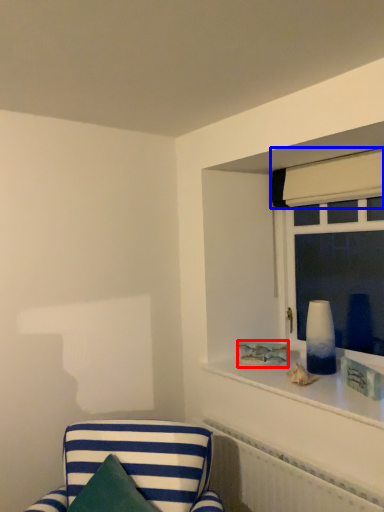
Question: Which object appears farthest to the camera in this image, picture frame (highlighted by a red box) or curtain (highlighted by a blue box)?

Choices:
 (A) picture frame
 (B) curtain

Answer: (A)